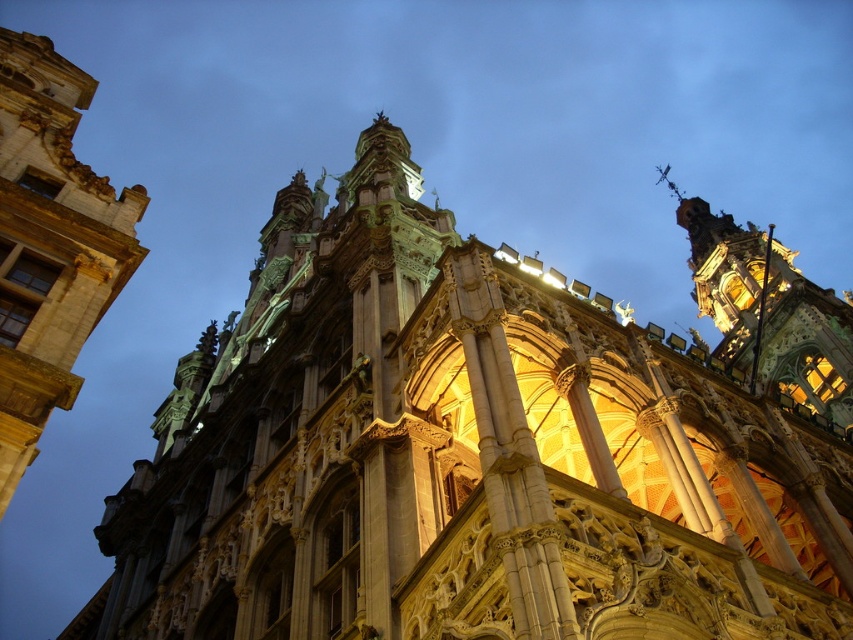
You are an architect analyzing the symmetry of the building. Which tower, the golden stone tower at upper left or the gold ornate tower at upper right, is smaller in size?

The golden stone tower at upper left is smaller in size compared to the gold ornate tower at upper right.

You are an architect analyzing the symmetry of the building. Which of the two towers, the golden stone tower at upper left or the gold ornate tower at upper right, has a larger diameter?

The gold ornate tower at upper right has a larger diameter than the golden stone tower at upper left.

You are standing in front of the grand Gothic Revival building and want to take a photo of the golden stone tower at upper left. Based on its position, which direction should you face to ensure it is centered in your camera view?

The golden stone tower at upper left is located at point coordinates, so you should face the upper left direction to center it in your camera view.